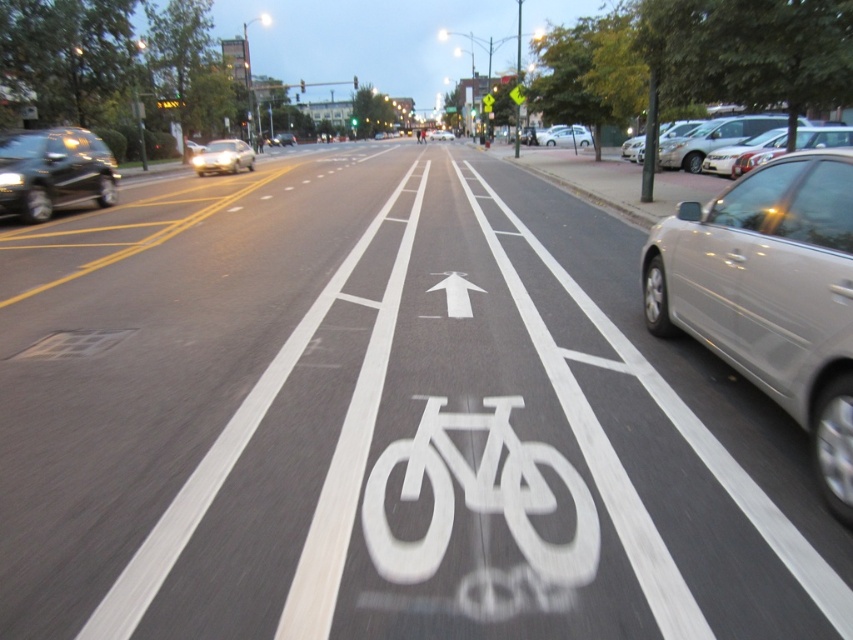
Identify the location of silver metallic car at right. The width and height of the screenshot is (853, 640). (770, 294).

Does point (844, 390) come behind point (592, 141)?

No.

Locate an element on the screen. silver metallic car at right is located at coordinates (770, 294).

Can you confirm if matte black suv at left is positioned to the left of white matte sedan at center?

Correct, you'll find matte black suv at left to the left of white matte sedan at center.

Does matte black suv at left appear under white matte sedan at center?

Yes.

Between point (10, 170) and point (543, 140), which one is positioned behind?

The point (543, 140) is more distant.

I want to click on matte black suv at left, so click(53, 172).

Which is more to the right, silver metallic car at right or satin silver sedan at center-left?

Positioned to the right is silver metallic car at right.

Can you confirm if silver metallic car at right is bigger than satin silver sedan at center-left?

No, silver metallic car at right is not bigger than satin silver sedan at center-left.

Is point (848, 234) closer to viewer compared to point (218, 141)?

Yes, it is.

Where is `silver metallic car at right`? Image resolution: width=853 pixels, height=640 pixels. silver metallic car at right is located at coordinates (770, 294).